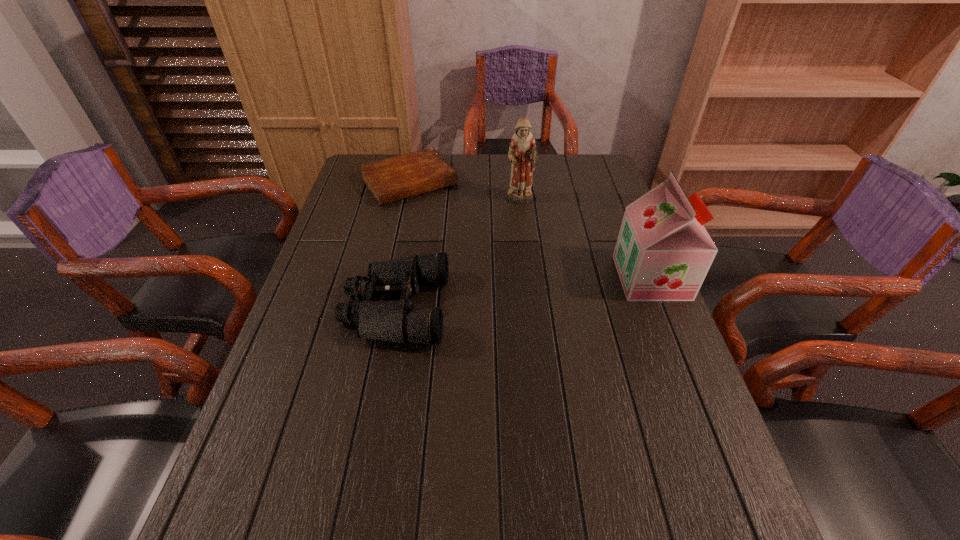
Image resolution: width=960 pixels, height=540 pixels. I want to click on binoculars, so click(x=396, y=321).

Identify the location of the rightmost object. pos(663,252).

You are a GUI agent. You are given a task and a screenshot of the screen. Output one action in this format:
    pyautogui.click(x=<x>, y=<y>)
    Task: Click on the figurine
    
    Given the screenshot: What is the action you would take?
    pyautogui.click(x=522, y=154)

You are a GUI agent. You are given a task and a screenshot of the screen. Output one action in this format:
    pyautogui.click(x=<x>, y=<y>)
    Task: Click on the Bible
    The height and width of the screenshot is (540, 960).
    Given the screenshot: What is the action you would take?
    pyautogui.click(x=396, y=178)

At what (x,y) coordinates should I click in order to perform the action: click on vacant area situated through the eyepieces of the second shortest object. Please return your answer as a coordinate pair (x, y). Looking at the image, I should click on (316, 308).

The height and width of the screenshot is (540, 960). In order to click on vacant point located 0.390m on the front-facing side of the figurine in this screenshot , I will do `click(554, 294)`.

You are a GUI agent. You are given a task and a screenshot of the screen. Output one action in this format:
    pyautogui.click(x=<x>, y=<y>)
    Task: Click on the vacant area situated 0.290m on the front-facing side of the figurine
    
    Given the screenshot: What is the action you would take?
    pyautogui.click(x=544, y=268)

I want to click on free space located on the front-facing side of the figurine, so click(547, 275).

This screenshot has width=960, height=540. I want to click on blank space located on the spine side of the Bible, so click(x=439, y=217).

Locate an element on the screen. vacant area situated 0.160m on the spine side of the Bible is located at coordinates (450, 231).